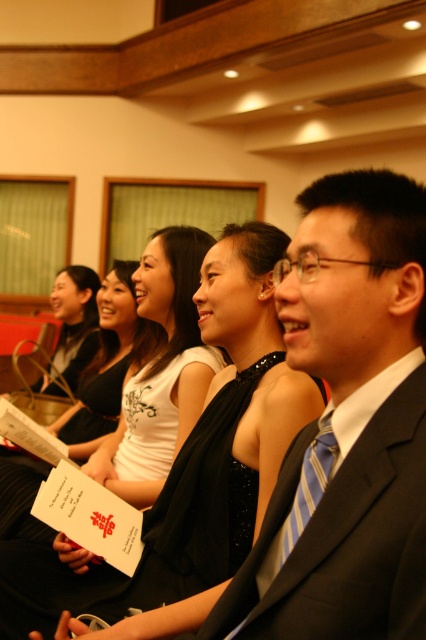
Between white matte paper at center and blue striped tie at right, which one has less height?

Standing shorter between the two is blue striped tie at right.

Can you confirm if white matte paper at center is shorter than blue striped tie at right?

No.

At what (x,y) coordinates should I click in order to perform the action: click on white matte paper at center. Please return your answer as a coordinate pair (x, y). The height and width of the screenshot is (640, 426). Looking at the image, I should click on (106, 364).

Can you confirm if dark gray suit at center is bigger than blue striped tie at right?

Yes, dark gray suit at center is bigger than blue striped tie at right.

Does point (322, 625) lie in front of point (301, 492)?

Yes.

Which is behind, point (339, 554) or point (284, 522)?

Positioned behind is point (284, 522).

Identify the location of dark gray suit at center. (345, 529).

Based on the photo, who is more forward, (331, 477) or (97, 433)?

Point (331, 477) is in front.

Is dark gray suit at center bigger than white matte paper at center?

Actually, dark gray suit at center might be smaller than white matte paper at center.

Between point (242, 602) and point (80, 429), which one is positioned behind?

The point (80, 429) is behind.

At what (x,y) coordinates should I click in order to perform the action: click on dark gray suit at center. Please return your answer as a coordinate pair (x, y). The image size is (426, 640). Looking at the image, I should click on (345, 529).